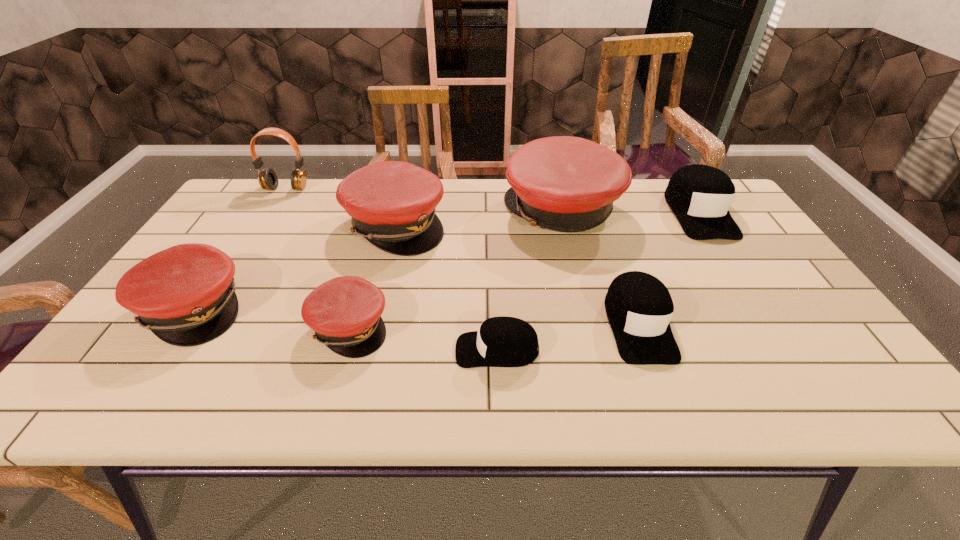
Identify the location of free spot located 0.110m on the front-facing side of the smallest red cap. This screenshot has height=540, width=960. (437, 327).

At what (x,y) coordinates should I click in order to perform the action: click on free spot located 0.330m on the front-facing side of the shortest cap. Please return your answer as a coordinate pair (x, y). Looking at the image, I should click on (302, 350).

Locate an element on the screen. This screenshot has height=540, width=960. free region located on the front-facing side of the shortest cap is located at coordinates (423, 350).

The image size is (960, 540). In order to click on vacant space located on the front-facing side of the shortest cap in this screenshot , I will do `click(368, 350)`.

Locate an element on the screen. The image size is (960, 540). headset that is at the far edge is located at coordinates (267, 178).

Identify the location of object that is positioned at the near edge. (502, 341).

At what (x,y) coordinates should I click in order to perform the action: click on headset at the left edge. Please return your answer as a coordinate pair (x, y). The width and height of the screenshot is (960, 540). Looking at the image, I should click on pos(267,178).

This screenshot has height=540, width=960. In order to click on cap positioned at the left edge in this screenshot , I will do `click(185, 295)`.

Find the location of a particular element. object present at the right edge is located at coordinates (699, 195).

Locate an element on the screen. This screenshot has height=540, width=960. object located at the far left corner is located at coordinates (267, 178).